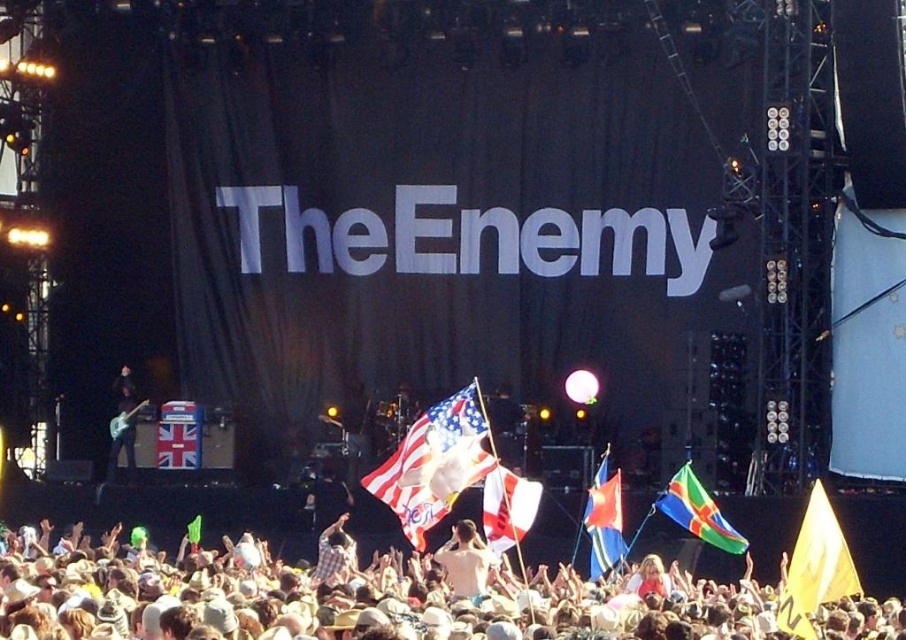
Question: Can you confirm if shiny metallic tank top at center is positioned above shiny black guitar at left?

Choices:
 (A) no
 (B) yes

Answer: (A)

Question: Among these points, which one is nearest to the camera?

Choices:
 (A) (683, 513)
 (B) (603, 468)

Answer: (A)

Question: Is white cotton crowd at lower center smaller than shiny metallic tank top at center?

Choices:
 (A) yes
 (B) no

Answer: (B)

Question: Which of the following is the farthest from the observer?

Choices:
 (A) (398, 470)
 (B) (610, 561)
 (C) (135, 397)
 (D) (814, 604)

Answer: (C)

Question: Can you confirm if yellow fabric flag at center is positioned to the right of plaid shirt at center?

Choices:
 (A) no
 (B) yes

Answer: (B)

Question: Which object appears closest to the camera in this image?

Choices:
 (A) blue fabric flag at center
 (B) white fabric flag at center
 (C) plaid shirt at center

Answer: (B)